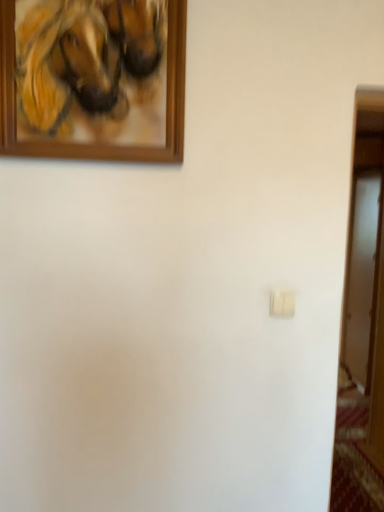
Question: Is wooden picture frame at upper left in front of or behind white matte light switch at center in the image?

Choices:
 (A) front
 (B) behind

Answer: (A)

Question: From a real-world perspective, is wooden picture frame at upper left above or below white matte light switch at center?

Choices:
 (A) above
 (B) below

Answer: (A)

Question: Would you say wooden picture frame at upper left is inside or outside white matte light switch at center?

Choices:
 (A) inside
 (B) outside

Answer: (B)

Question: Is white matte light switch at center inside or outside of wooden picture frame at upper left?

Choices:
 (A) inside
 (B) outside

Answer: (B)

Question: In terms of size, does white matte light switch at center appear bigger or smaller than wooden picture frame at upper left?

Choices:
 (A) big
 (B) small

Answer: (B)

Question: From a real-world perspective, relative to wooden picture frame at upper left, is white matte light switch at center vertically above or below?

Choices:
 (A) above
 (B) below

Answer: (B)

Question: From the image's perspective, relative to wooden picture frame at upper left, is white matte light switch at center above or below?

Choices:
 (A) below
 (B) above

Answer: (A)